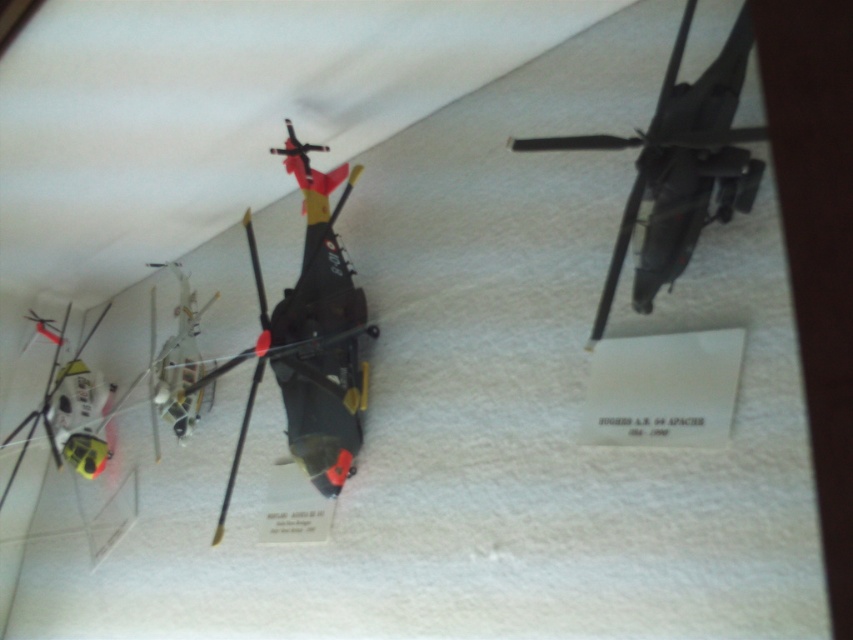
You are a museum visitor observing the helicopter models. Which helicopter is positioned higher up in the image, the matte black helicopter at upper right or the metallic silver helicopter at center?

The matte black helicopter at upper right is positioned higher up in the image than the metallic silver helicopter at center.